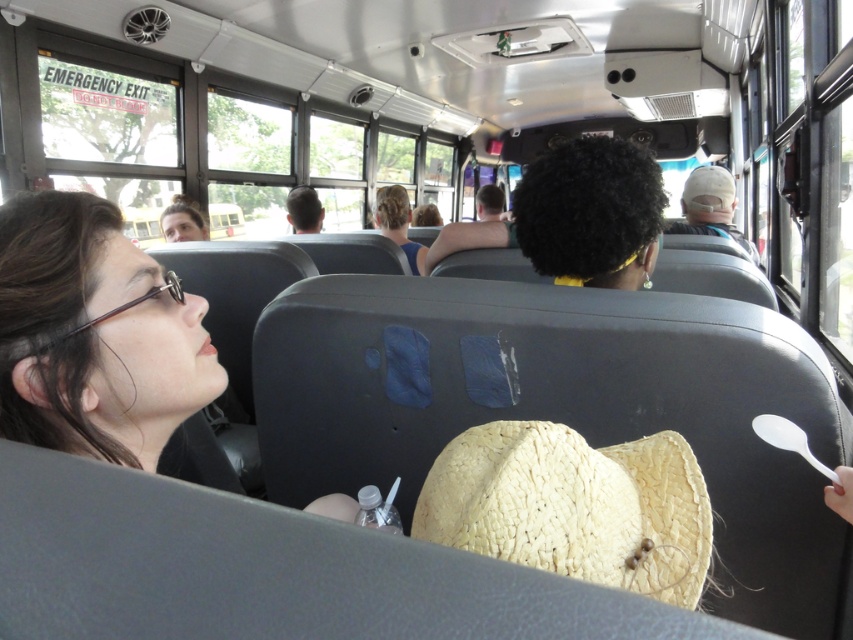
Can you confirm if woven straw cowboy hat at center is taller than white plastic spoon at lower right?

Yes, woven straw cowboy hat at center is taller than white plastic spoon at lower right.

This screenshot has width=853, height=640. What do you see at coordinates (573, 506) in the screenshot?
I see `woven straw cowboy hat at center` at bounding box center [573, 506].

Image resolution: width=853 pixels, height=640 pixels. In order to click on woven straw cowboy hat at center in this screenshot , I will do `click(573, 506)`.

Can you confirm if straw hat at upper center is positioned to the right of white plastic spoon at lower right?

Indeed, straw hat at upper center is positioned on the right side of white plastic spoon at lower right.

The width and height of the screenshot is (853, 640). Identify the location of straw hat at upper center. (708, 189).

Which is more to the right, woven straw cowboy hat at center or straw hat at upper center?

straw hat at upper center is more to the right.

From the picture: Is woven straw cowboy hat at center to the right of straw hat at upper center from the viewer's perspective?

No, woven straw cowboy hat at center is not to the right of straw hat at upper center.

Identify the location of woven straw cowboy hat at center. This screenshot has height=640, width=853. (573, 506).